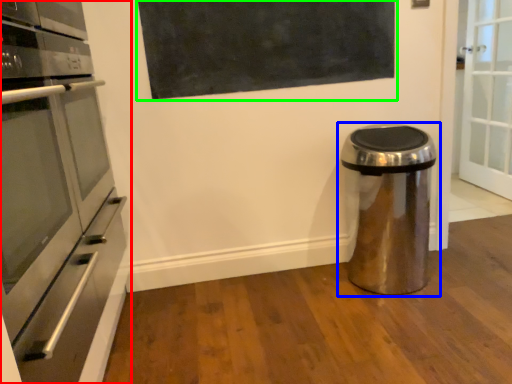
Question: Estimate the real-world distances between objects in this image. Which object is closer to home appliance (highlighted by a red box), waste container (highlighted by a blue box) or bulletin board (highlighted by a green box)?

Choices:
 (A) waste container
 (B) bulletin board

Answer: (B)